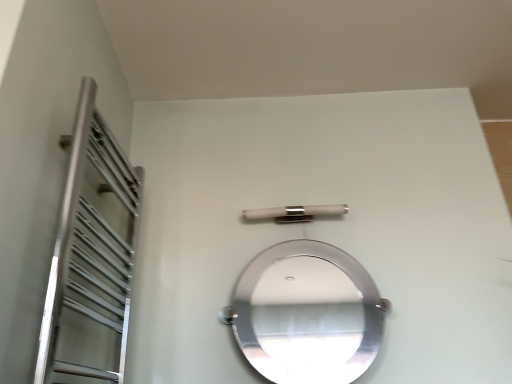
Question: From the image's perspective, relative to polished silver mirror at center, is silver metallic towel rack at left above or below?

Choices:
 (A) above
 (B) below

Answer: (A)

Question: From a real-world perspective, is silver metallic towel rack at left physically located above or below polished silver mirror at center?

Choices:
 (A) above
 (B) below

Answer: (A)

Question: Estimate the real-world distances between objects in this image. Which object is farther from the polished silver mirror at center?

Choices:
 (A) silver metallic towel rack at left
 (B) satin nickel bar at center

Answer: (A)

Question: Which is farther from the polished silver mirror at center?

Choices:
 (A) silver metallic towel rack at left
 (B) satin nickel bar at center

Answer: (A)